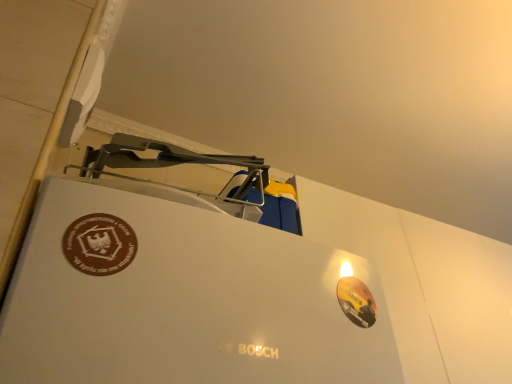
Question: Which is correct: brown matte sticker at upper left, which appears as the 1th logo when viewed from the front, is inside glossy orange sticker at lower right, the second logo viewed from the front, or outside of it?

Choices:
 (A) inside
 (B) outside

Answer: (B)

Question: Would you say brown matte sticker at upper left, placed as the 2th logo when sorted from right to left, is to the left or to the right of glossy orange sticker at lower right, the second logo positioned from the left, in the picture?

Choices:
 (A) left
 (B) right

Answer: (A)

Question: From a real-world perspective, relative to glossy orange sticker at lower right, the second logo viewed from the top, is brown matte sticker at upper left, which appears as the 1th logo when viewed from the front, vertically above or below?

Choices:
 (A) below
 (B) above

Answer: (B)

Question: Looking at their shapes, would you say glossy orange sticker at lower right, the 1th logo in the bottom-to-top sequence, is wider or thinner than brown matte sticker at upper left, which is the 1th logo from left to right?

Choices:
 (A) wide
 (B) thin

Answer: (A)

Question: Considering the positions of glossy orange sticker at lower right, the 1th logo in the bottom-to-top sequence, and brown matte sticker at upper left, placed as the 2th logo when sorted from right to left, in the image, is glossy orange sticker at lower right, the 1th logo in the bottom-to-top sequence, taller or shorter than brown matte sticker at upper left, placed as the 2th logo when sorted from right to left,?

Choices:
 (A) tall
 (B) short

Answer: (B)

Question: From the image's perspective, is glossy orange sticker at lower right, the second logo positioned from the left, located above or below brown matte sticker at upper left, which appears as the 1th logo when viewed from the front?

Choices:
 (A) above
 (B) below

Answer: (B)

Question: Considering the positions of point (348, 284) and point (94, 246), is point (348, 284) closer or farther from the camera than point (94, 246)?

Choices:
 (A) closer
 (B) farther

Answer: (B)